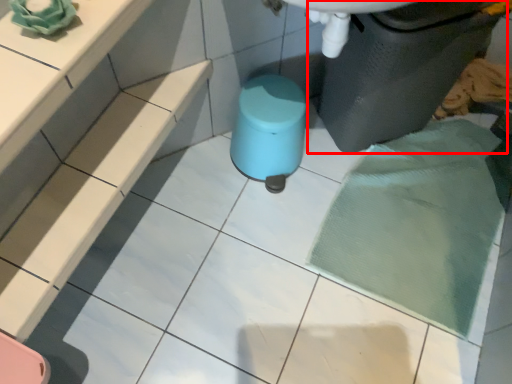
Question: From the image's perspective, what is the correct spatial relationship of waste container (annotated by the red box) in relation to stool?

Choices:
 (A) above
 (B) below

Answer: (A)